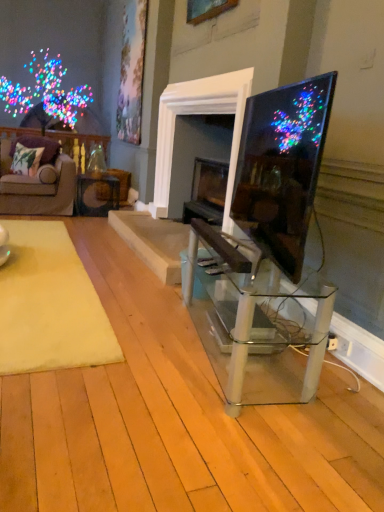
Locate an element on the screen. blank space above yellow plush rug at lower left (from a real-world perspective) is located at coordinates (37, 270).